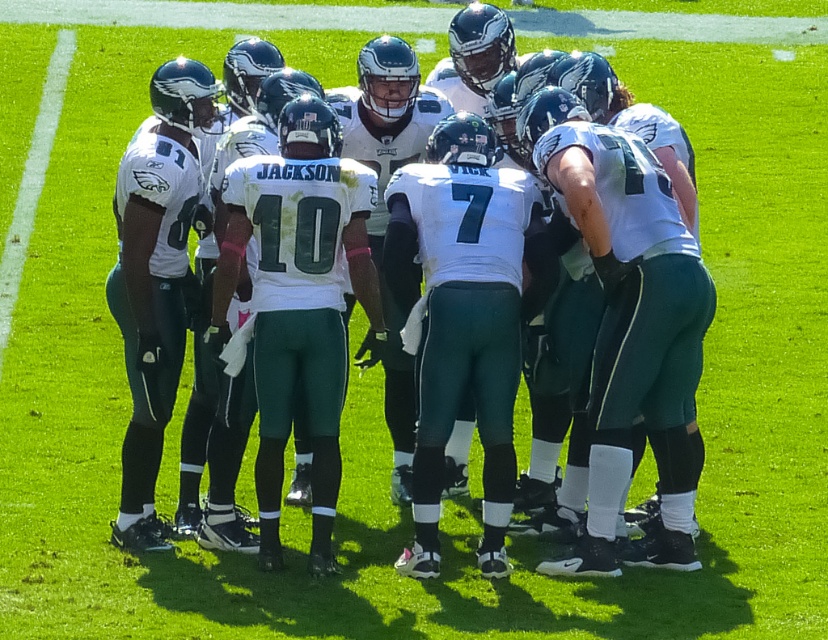
Which is in front, point (412, 177) or point (51, 128)?

Point (412, 177) is more forward.

Who is positioned more to the left, white jersey at center or white painted line at lower left?

white painted line at lower left is more to the left.

At what (x,y) coordinates should I click in order to perform the action: click on white jersey at center. Please return your answer as a coordinate pair (x, y). This screenshot has height=640, width=828. Looking at the image, I should click on (595, 301).

This screenshot has height=640, width=828. I want to click on white jersey at center, so (x=595, y=301).